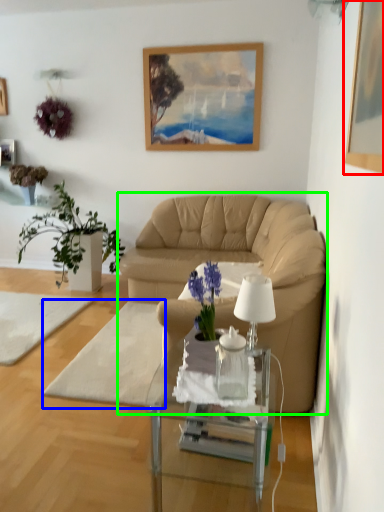
Question: Which object is the farthest from picture frame (highlighted by a red box)? Choose among these: footrest (highlighted by a blue box) or studio couch (highlighted by a green box).

Choices:
 (A) footrest
 (B) studio couch

Answer: (A)